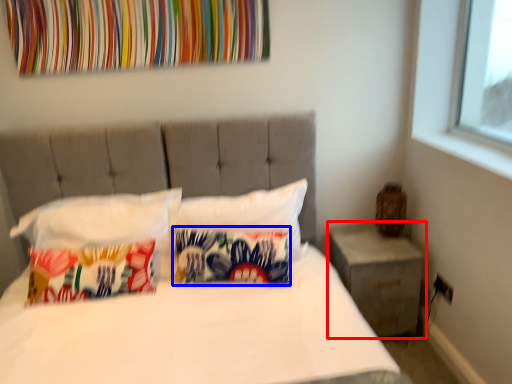
Question: Which of the following is the closest to the observer, nightstand (highlighted by a red box) or pillow (highlighted by a blue box)?

Choices:
 (A) nightstand
 (B) pillow

Answer: (B)